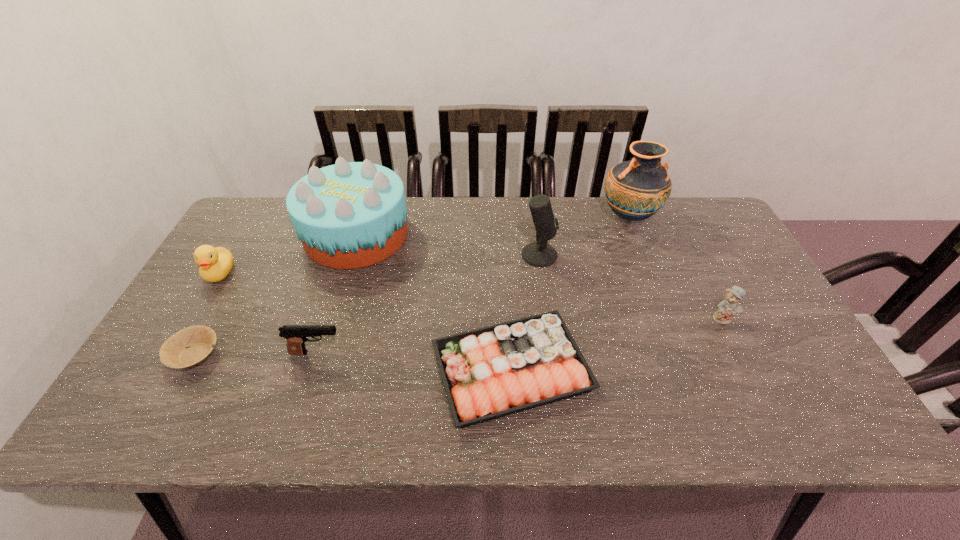
The width and height of the screenshot is (960, 540). Identify the location of bowl that is positioned at the left edge. tap(190, 346).

Identify the location of object present at the right edge. (729, 306).

Locate an element on the screen. The width and height of the screenshot is (960, 540). vacant space at the far edge of the desktop is located at coordinates (424, 222).

Locate an element on the screen. The height and width of the screenshot is (540, 960). vacant region at the near edge of the desktop is located at coordinates (247, 427).

Find the location of a particular element. The height and width of the screenshot is (540, 960). free location at the left edge is located at coordinates (226, 289).

The width and height of the screenshot is (960, 540). Identify the location of free space at the far right corner of the desktop. (693, 204).

Identify the location of vacant space at the near right corner. This screenshot has width=960, height=540. (776, 410).

Identify the location of empty space that is in between the shortest object and the platter. (353, 362).

In order to click on free space that is in between the duckling and the platter in this screenshot , I will do `click(366, 321)`.

Find the location of `free spot between the pottery and the cake`. free spot between the pottery and the cake is located at coordinates (492, 226).